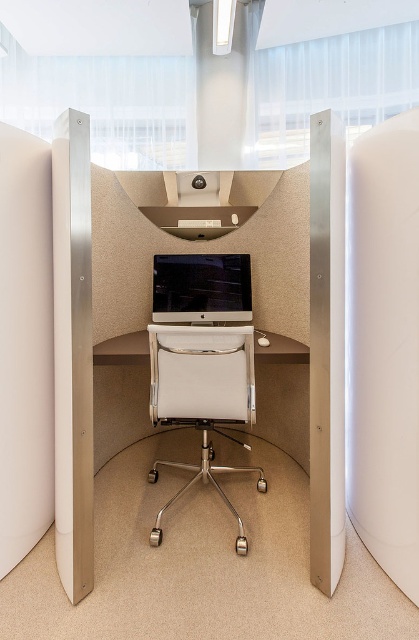
Between matte beige desk at center and satin silver monitor at center, which one is positioned higher?

Positioned higher is satin silver monitor at center.

Does matte beige desk at center have a lesser height compared to satin silver monitor at center?

Incorrect, matte beige desk at center's height does not fall short of satin silver monitor at center's.

Identify the location of matte beige desk at center. The width and height of the screenshot is (419, 640). (326, 352).

Does point (183, 422) come behind point (227, 259)?

No, (183, 422) is closer to viewer.

Can you confirm if white leather swivel chair at center is shorter than satin silver monitor at center?

In fact, white leather swivel chair at center may be taller than satin silver monitor at center.

The image size is (419, 640). In order to click on white leather swivel chair at center in this screenshot , I will do `click(201, 396)`.

Image resolution: width=419 pixels, height=640 pixels. Identify the location of white leather swivel chair at center. pyautogui.click(x=201, y=396).

Does matte beige desk at center have a lesser width compared to white leather swivel chair at center?

Yes.

Is point (335, 483) closer to viewer compared to point (214, 369)?

Yes, it is in front of point (214, 369).

In order to click on matte beige desk at center in this screenshot , I will do `click(326, 352)`.